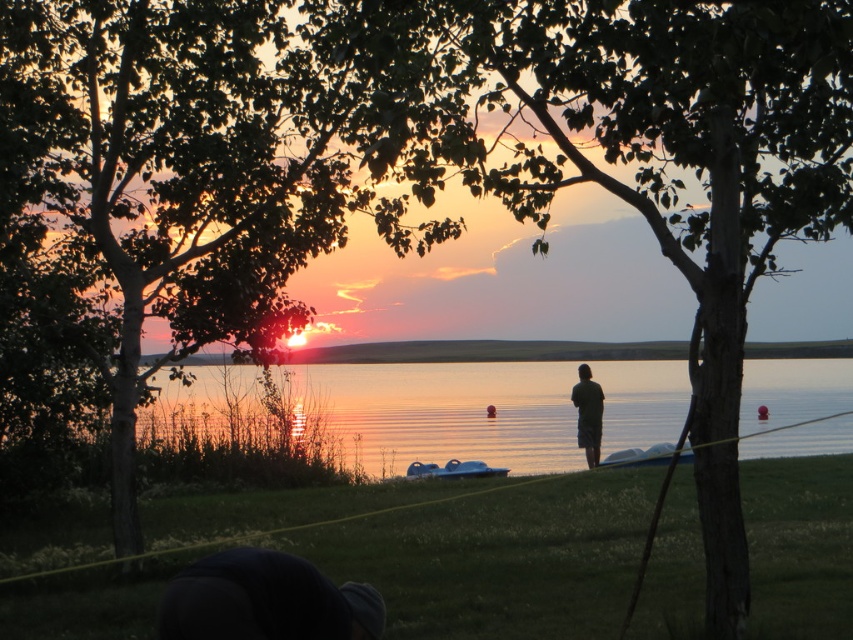
Is point (587, 412) in front of point (438, 477)?

No, it is behind (438, 477).

Measure the distance from dark green fabric at center to blue rubber boat at center.

dark green fabric at center and blue rubber boat at center are 5.92 feet apart.

Is point (598, 449) positioned behind point (491, 472)?

That is True.

The width and height of the screenshot is (853, 640). Find the location of `dark green fabric at center`. dark green fabric at center is located at coordinates (589, 413).

Is the position of reflective glass water at center less distant than that of dark green fabric at center?

Yes, reflective glass water at center is closer to the viewer.

This screenshot has height=640, width=853. In order to click on reflective glass water at center in this screenshot , I will do `click(440, 413)`.

The image size is (853, 640). What are the coordinates of `reflective glass water at center` in the screenshot? It's located at (440, 413).

Based on the photo, is green leafy tree at upper left closer to the viewer compared to blue rubber boat at center?

Yes, it is.

Is green leafy tree at upper left above blue rubber boat at center?

Indeed, green leafy tree at upper left is positioned over blue rubber boat at center.

What do you see at coordinates (202, 173) in the screenshot?
I see `green leafy tree at upper left` at bounding box center [202, 173].

Find the location of a particular element. green leafy tree at upper left is located at coordinates (202, 173).